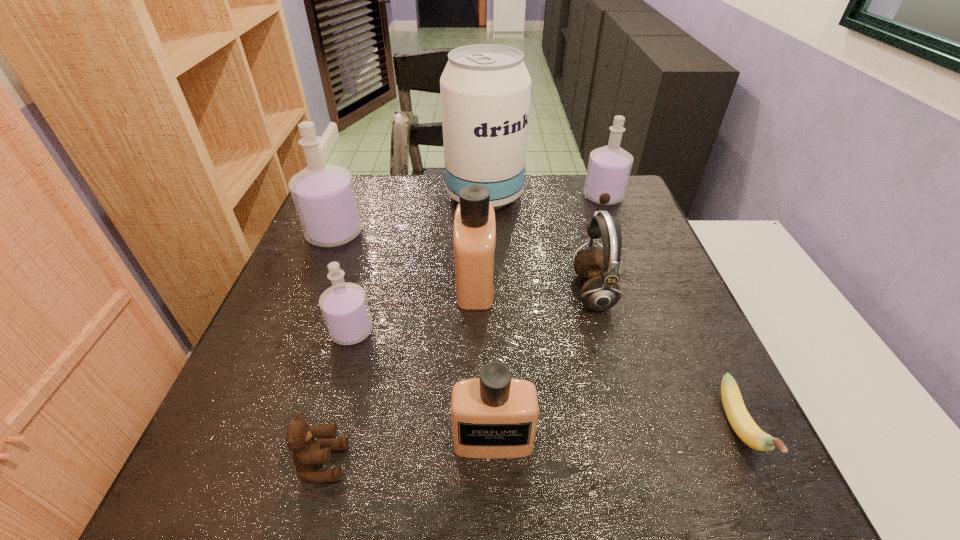
Identify which perfume is the closest to the rightmost object. Please provide its 2D coordinates. Your answer should be formatted as a tuple, i.e. [(x, y)], where the tuple contains the x and y coordinates of a point satisfying the conditions above.

[(495, 416)]

You are a GUI agent. You are given a task and a screenshot of the screen. Output one action in this format:
    pyautogui.click(x=<x>, y=<y>)
    Task: Click on the perfume that is the third nearest to the nearer beige perfume
    The height and width of the screenshot is (540, 960).
    Given the screenshot: What is the action you would take?
    pyautogui.click(x=324, y=197)

Locate which purple perfume is the closest to the smallest purple perfume. Please provide its 2D coordinates. Your answer should be formatted as a tuple, i.e. [(x, y)], where the tuple contains the x and y coordinates of a point satisfying the conditions above.

[(324, 197)]

Where is `the closest purple perfume to the eighth object from left to right`? The image size is (960, 540). the closest purple perfume to the eighth object from left to right is located at coordinates (324, 197).